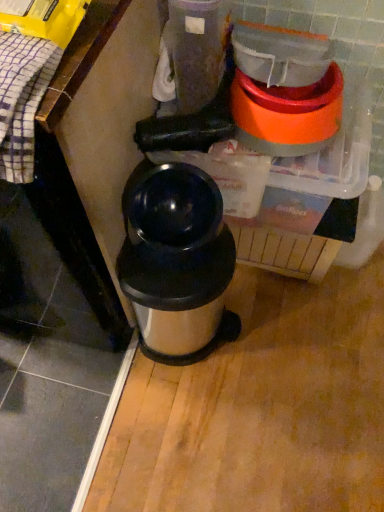
This screenshot has width=384, height=512. I want to click on free location to the right of stainless steel thermos at center, so click(x=282, y=331).